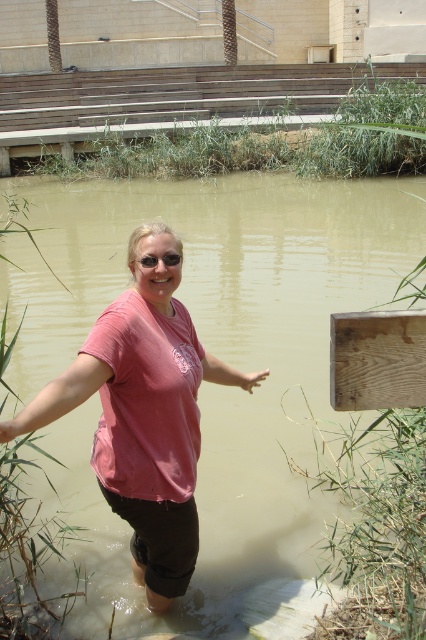
Question: Is pink matte shirt at center positioned at the back of sunglasses at center?

Choices:
 (A) no
 (B) yes

Answer: (A)

Question: In this image, where is pink matte shirt at center located relative to sunglasses at center?

Choices:
 (A) left
 (B) right

Answer: (A)

Question: Which object appears farthest from the camera in this image?

Choices:
 (A) sunglasses at center
 (B) pink matte shirt at center

Answer: (A)

Question: Which point is closer to the camera?

Choices:
 (A) (108, 419)
 (B) (173, 260)

Answer: (B)

Question: Can you confirm if pink matte shirt at center is positioned to the right of sunglasses at center?

Choices:
 (A) no
 (B) yes

Answer: (A)